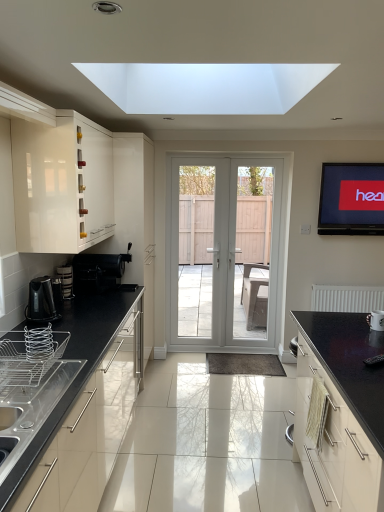
In order to click on vacant space in black plastic coffee machine at lower left (from a real-world perspective) in this screenshot , I will do `click(122, 289)`.